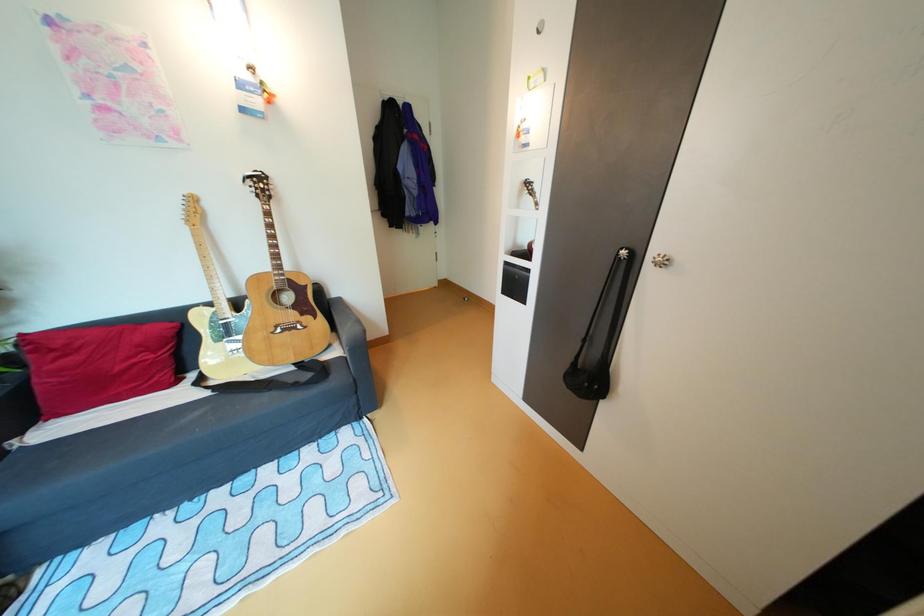
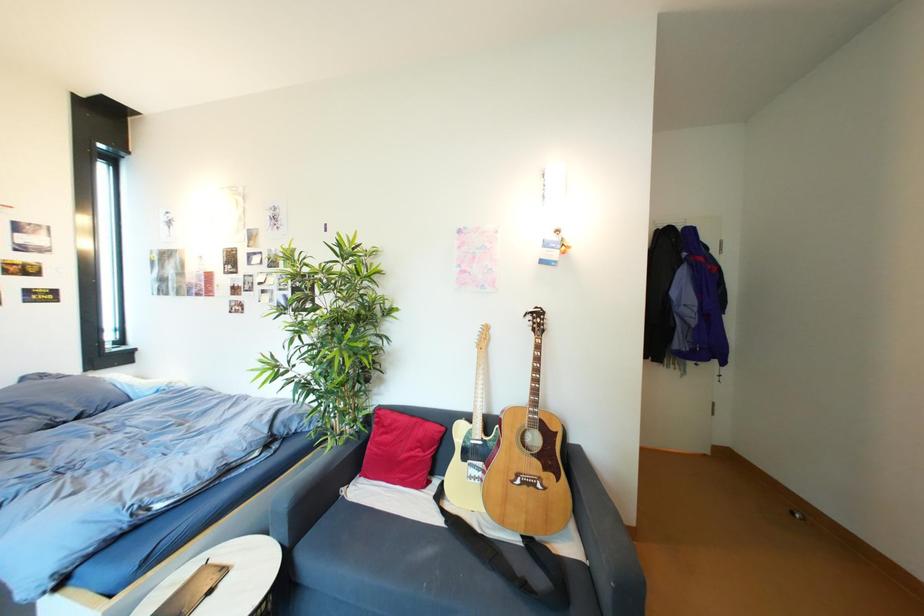
First-person continuous shooting, in which direction is the camera rotating?

The camera's rotation is toward left-up.